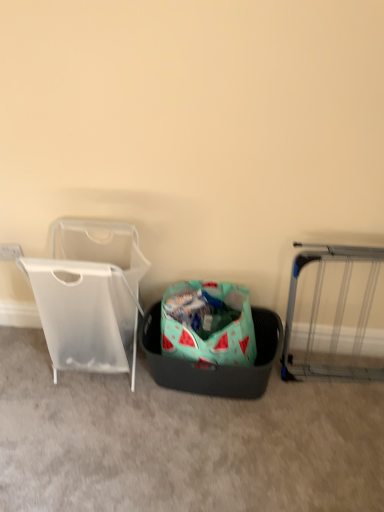
Find the location of a particular element. silver metallic gate at right is located at coordinates (335, 313).

You are a GUI agent. You are given a task and a screenshot of the screen. Output one action in this format:
    pyautogui.click(x=<x>, y=<y>)
    Task: Click on the silver metallic gate at right
    Image resolution: width=384 pixels, height=512 pixels.
    Given the screenshot: What is the action you would take?
    pyautogui.click(x=335, y=313)

From a real-world perspective, is transparent plastic laundry basket at left positioned over silver metallic gate at right based on gravity?

Correct, in the physical world, transparent plastic laundry basket at left is higher than silver metallic gate at right.

How distant is transparent plastic laundry basket at left from silver metallic gate at right?

The distance of transparent plastic laundry basket at left from silver metallic gate at right is 85.49 centimeters.

Which is correct: transparent plastic laundry basket at left is inside silver metallic gate at right, or outside of it?

transparent plastic laundry basket at left is not enclosed by silver metallic gate at right.

Can you confirm if transparent plastic laundry basket at left is taller than silver metallic gate at right?

Indeed, transparent plastic laundry basket at left has a greater height compared to silver metallic gate at right.

Which object is positioned more to the left, teal fabric laundry basket at center or transparent plastic laundry basket at left?

Positioned to the left is transparent plastic laundry basket at left.

Which is nearer, (261,371) or (86,367)?

Point (261,371).

Considering the sizes of objects teal fabric laundry basket at center and transparent plastic laundry basket at left in the image provided, who is wider, teal fabric laundry basket at center or transparent plastic laundry basket at left?

teal fabric laundry basket at center.

Is teal fabric laundry basket at center looking in the opposite direction of transparent plastic laundry basket at left?

No, teal fabric laundry basket at center's orientation is not away from transparent plastic laundry basket at left.

Would you say silver metallic gate at right is inside or outside transparent plastic laundry basket at left?

silver metallic gate at right is spatially situated outside transparent plastic laundry basket at left.

From the image's perspective, who appears lower, silver metallic gate at right or transparent plastic laundry basket at left?

Answer: silver metallic gate at right.

Would you say silver metallic gate at right is to the left or to the right of transparent plastic laundry basket at left in the picture?

From the image, it's evident that silver metallic gate at right is to the right of transparent plastic laundry basket at left.

Could you tell me if silver metallic gate at right is turned towards transparent plastic laundry basket at left?

No, silver metallic gate at right is not aimed at transparent plastic laundry basket at left.

Where is `baby carriage above the teal fabric laundry basket at center (from a real-world perspective)`? baby carriage above the teal fabric laundry basket at center (from a real-world perspective) is located at coordinates (89, 295).

Is transparent plastic laundry basket at left closer to the viewer compared to teal fabric laundry basket at center?

Yes, transparent plastic laundry basket at left is closer to the viewer.

From a real-world perspective, does transparent plastic laundry basket at left stand above teal fabric laundry basket at center?

Yes, from a real-world perspective, transparent plastic laundry basket at left is above teal fabric laundry basket at center.

Is transparent plastic laundry basket at left facing towards teal fabric laundry basket at center?

No, transparent plastic laundry basket at left does not turn towards teal fabric laundry basket at center.

How different are the orientations of silver metallic gate at right and teal fabric laundry basket at center in degrees?

2.21 degrees.

Which object is positioned more to the left, silver metallic gate at right or teal fabric laundry basket at center?

teal fabric laundry basket at center is more to the left.

Is silver metallic gate at right positioned with its back to teal fabric laundry basket at center?

No, silver metallic gate at right is not facing away from teal fabric laundry basket at center.

From the image's perspective, which one is positioned lower, silver metallic gate at right or teal fabric laundry basket at center?

teal fabric laundry basket at center appears lower in the image.

Is teal fabric laundry basket at center facing towards silver metallic gate at right?

No.

Does teal fabric laundry basket at center lie in front of silver metallic gate at right?

No, teal fabric laundry basket at center is behind silver metallic gate at right.

Is teal fabric laundry basket at center with silver metallic gate at right?

No, teal fabric laundry basket at center is not next to silver metallic gate at right.

Considering the sizes of teal fabric laundry basket at center and silver metallic gate at right in the image, is teal fabric laundry basket at center taller or shorter than silver metallic gate at right?

Clearly, teal fabric laundry basket at center is shorter compared to silver metallic gate at right.

Find the location of a particular element. This screenshot has height=512, width=384. furniture behind the transparent plastic laundry basket at left is located at coordinates [x=335, y=313].

Where is `laundry basket below the transparent plastic laundry basket at left (from the image's perspective)`? This screenshot has width=384, height=512. laundry basket below the transparent plastic laundry basket at left (from the image's perspective) is located at coordinates (209, 365).

Looking at the image, which one is located further to silver metallic gate at right, teal fabric laundry basket at center or transparent plastic laundry basket at left?

The object further to silver metallic gate at right is transparent plastic laundry basket at left.

Looking at the image, which one is located closer to silver metallic gate at right, transparent plastic laundry basket at left or teal fabric laundry basket at center?

Based on the image, teal fabric laundry basket at center appears to be nearer to silver metallic gate at right.

Considering their positions, is silver metallic gate at right positioned closer to transparent plastic laundry basket at left than teal fabric laundry basket at center?

teal fabric laundry basket at center is positioned closer to the anchor transparent plastic laundry basket at left.

Looking at the image, which one is located closer to teal fabric laundry basket at center, transparent plastic laundry basket at left or silver metallic gate at right?

silver metallic gate at right is closer to teal fabric laundry basket at center.

From the image, which object appears to be farther from transparent plastic laundry basket at left, teal fabric laundry basket at center or silver metallic gate at right?

silver metallic gate at right lies further to transparent plastic laundry basket at left than the other object.

Estimate the real-world distances between objects in this image. Which object is closer to teal fabric laundry basket at center, silver metallic gate at right or transparent plastic laundry basket at left?

The object closer to teal fabric laundry basket at center is silver metallic gate at right.

You are a GUI agent. You are given a task and a screenshot of the screen. Output one action in this format:
    pyautogui.click(x=<x>, y=<y>)
    Task: Click on the laundry basket between transparent plastic laundry basket at left and silver metallic gate at right
    The image size is (384, 512).
    Given the screenshot: What is the action you would take?
    pyautogui.click(x=209, y=365)